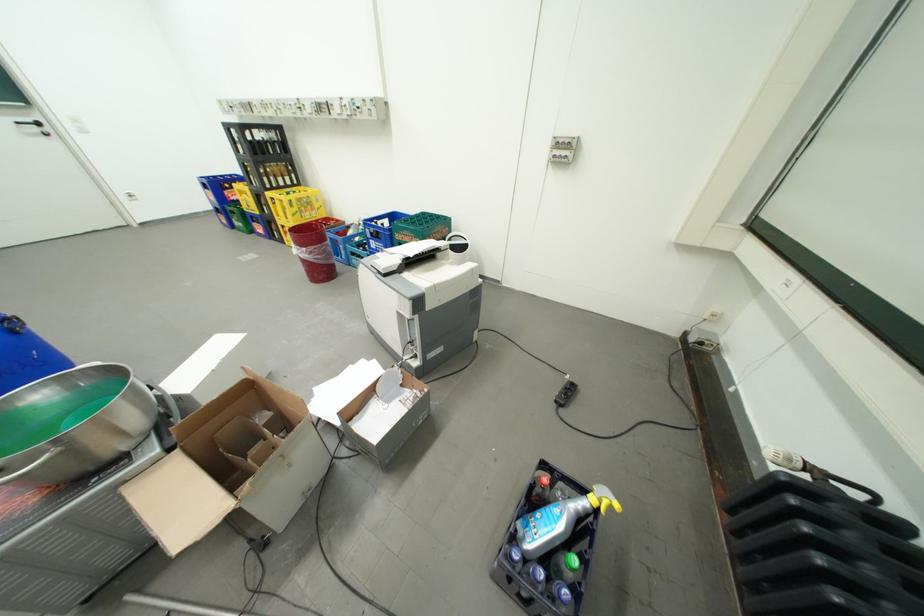
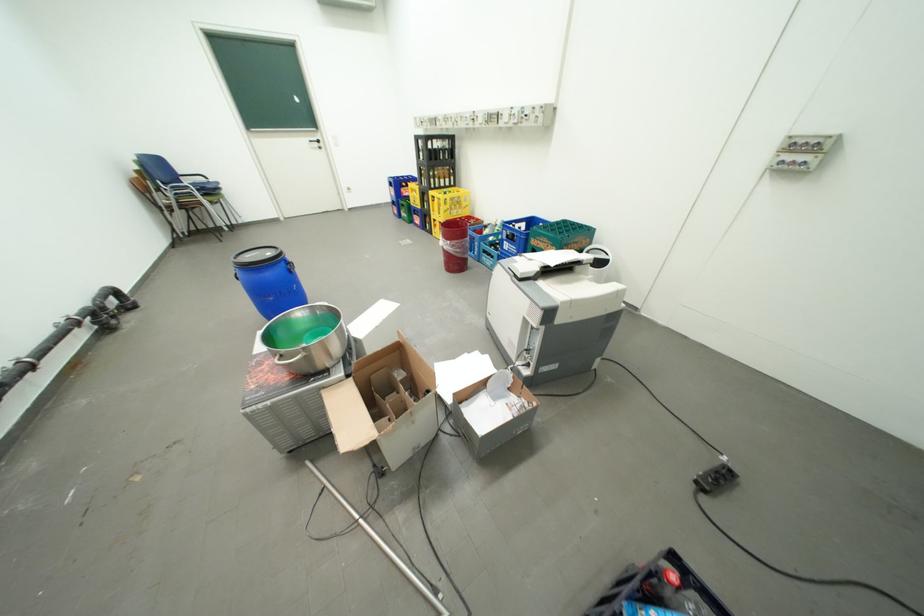
The point at (x=274, y=426) is marked in the first image. Where is the corresponding point in the second image?

(410, 382)